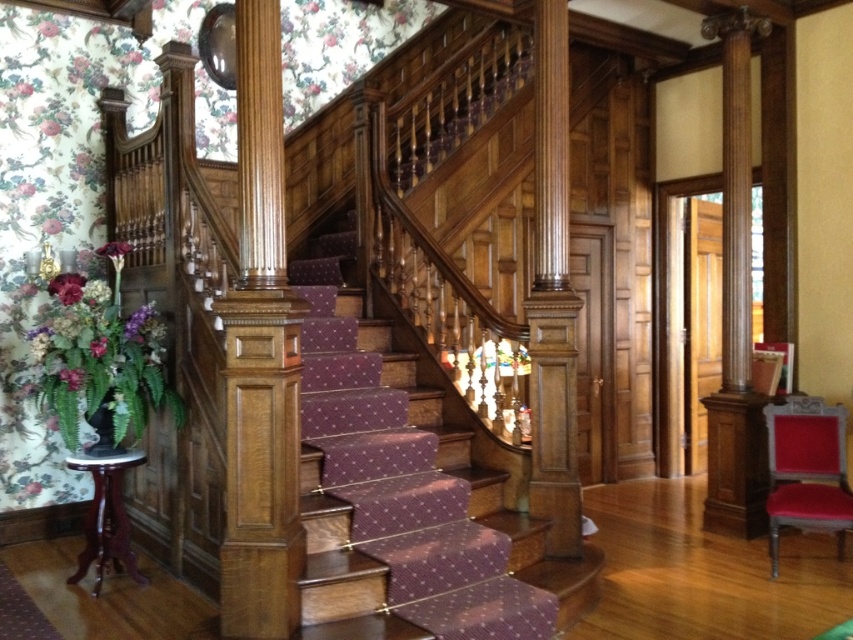
You are an interior designer planning to place a decorative sculpture between the polished oak pillar at center and the polished wood pillar at center. Which pillar should the sculpture be placed closer to if you want it to be closer to the wider pillar?

The polished oak pillar at center has a larger width than the polished wood pillar at center, so the sculpture should be placed closer to the polished oak pillar at center.

You are standing at the entrance of the grand staircase and want to locate the polished oak pillar at center. According to the spatial layout, where would you find it?

The polished oak pillar at center is located at point [260,358], so you can find it at that coordinate position.